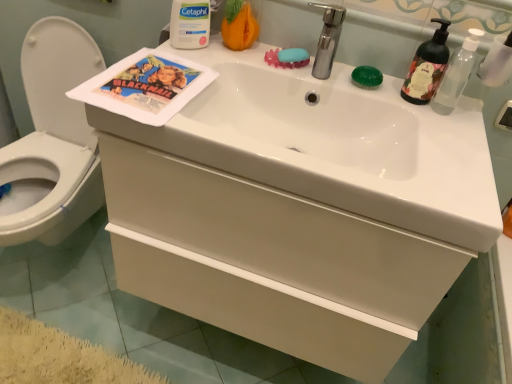
This screenshot has height=384, width=512. Identify the location of vacant space situated on the left part of green matte soap at upper right, the 1th soap in the right-to-left sequence. (316, 72).